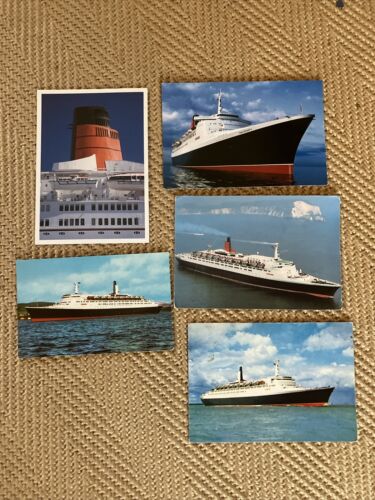
The image size is (375, 500). I want to click on spaces between photographs, so click(244, 319), click(182, 337), click(113, 248), click(250, 191), click(153, 145).